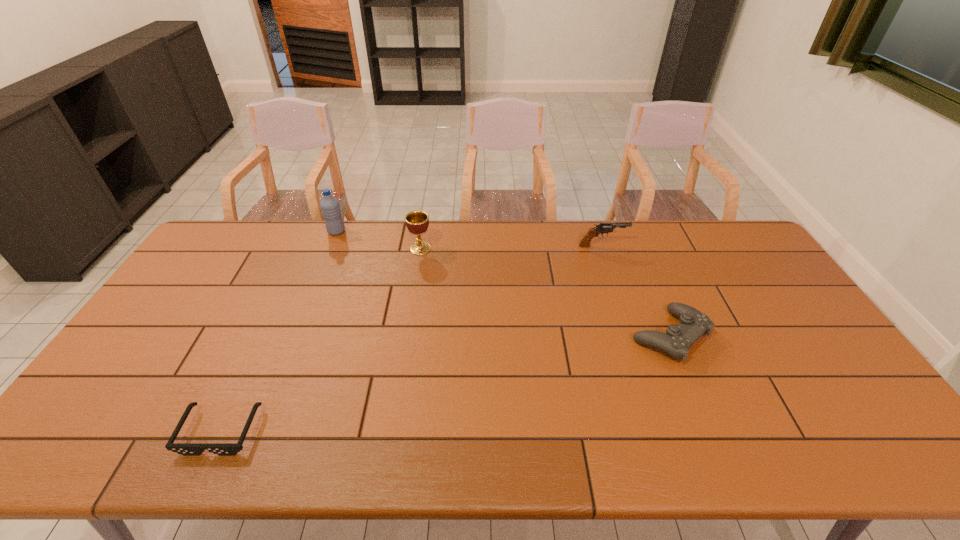
Identify the location of the farthest object. (330, 208).

Identify the location of water bottle. (330, 208).

The image size is (960, 540). Find the location of `chalice`. chalice is located at coordinates (417, 222).

Where is `the third object from left to right`? This screenshot has height=540, width=960. the third object from left to right is located at coordinates (417, 222).

This screenshot has width=960, height=540. I want to click on the third tallest object, so click(x=604, y=227).

Locate an element on the screen. control is located at coordinates (676, 342).

I want to click on the second nearest object, so click(x=676, y=342).

Find the location of a particular element. Image resolution: width=960 pixels, height=540 pixels. the nearest object is located at coordinates (186, 449).

This screenshot has height=540, width=960. I want to click on the shortest object, so click(186, 449).

Identify the location of free region located on the front of the tallest object. This screenshot has height=540, width=960. (328, 252).